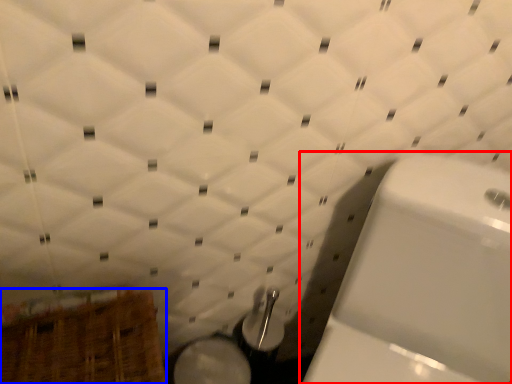
Question: Which object is further to the camera taking this photo, toilet (highlighted by a red box) or basket (highlighted by a blue box)?

Choices:
 (A) toilet
 (B) basket

Answer: (B)